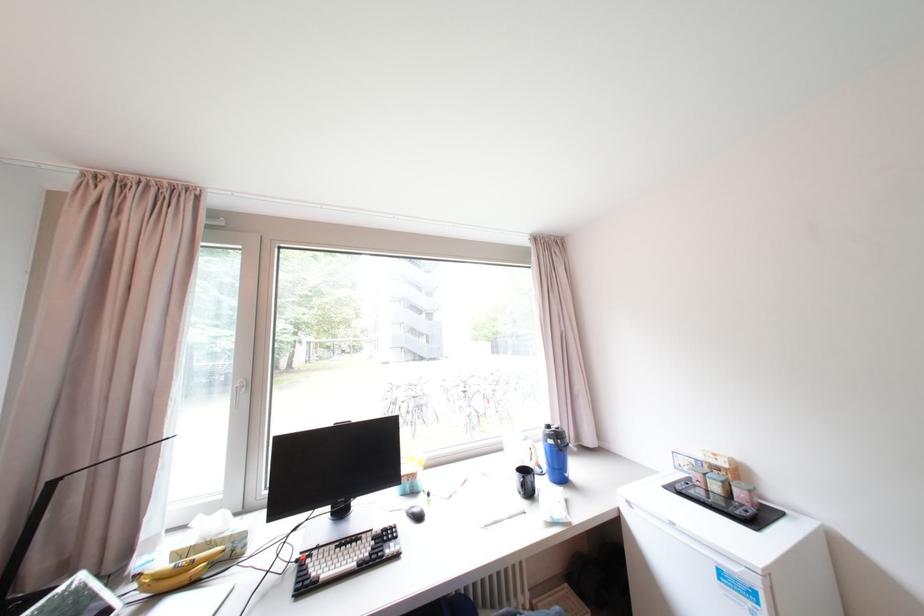
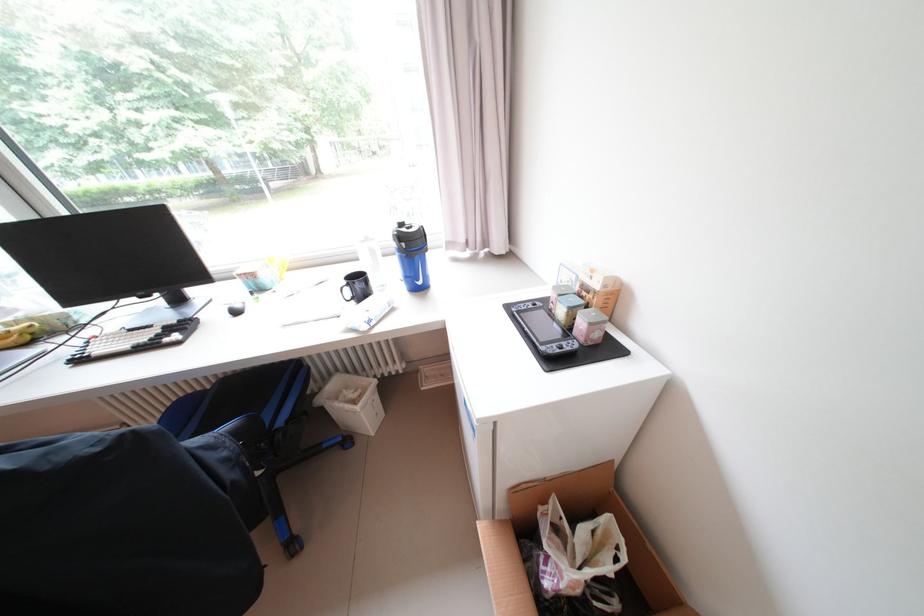
Locate, in the second image, the point that corresponds to (x=728, y=485) in the first image.

(574, 310)